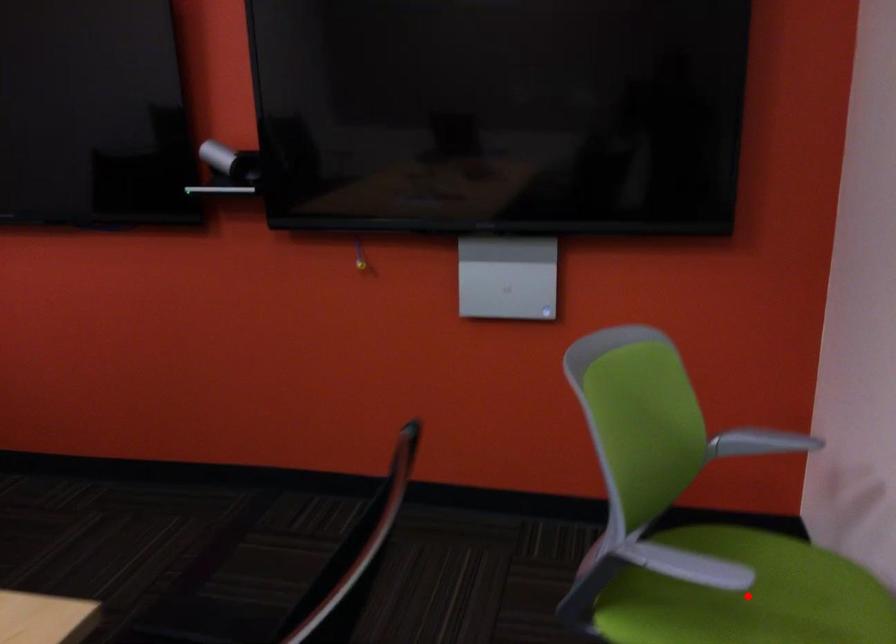
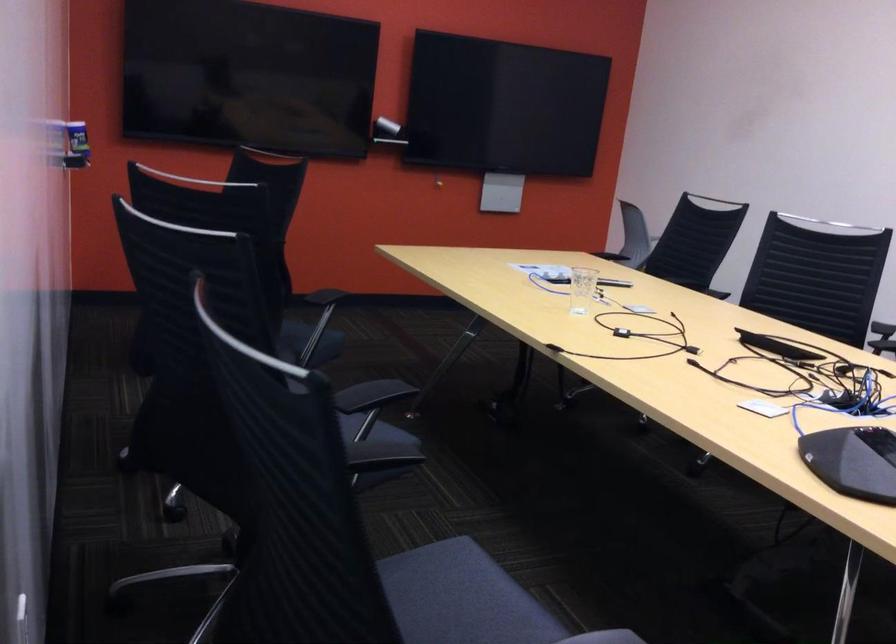
Question: I am providing you with two images of the same scene from different viewpoints. A red point is marked on the first image. Is the red point's position out of view in image 2?

Choices:
 (A) Yes
 (B) No

Answer: (A)